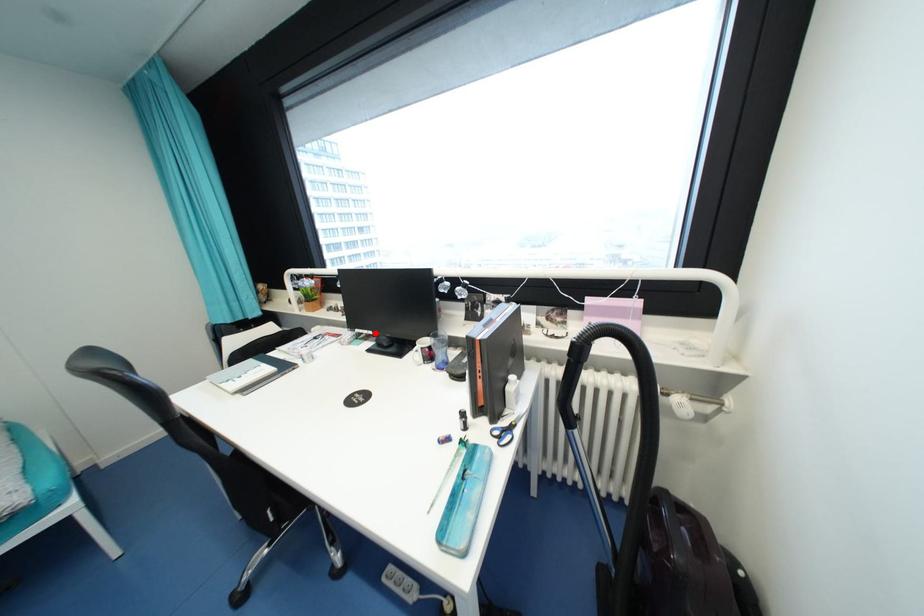
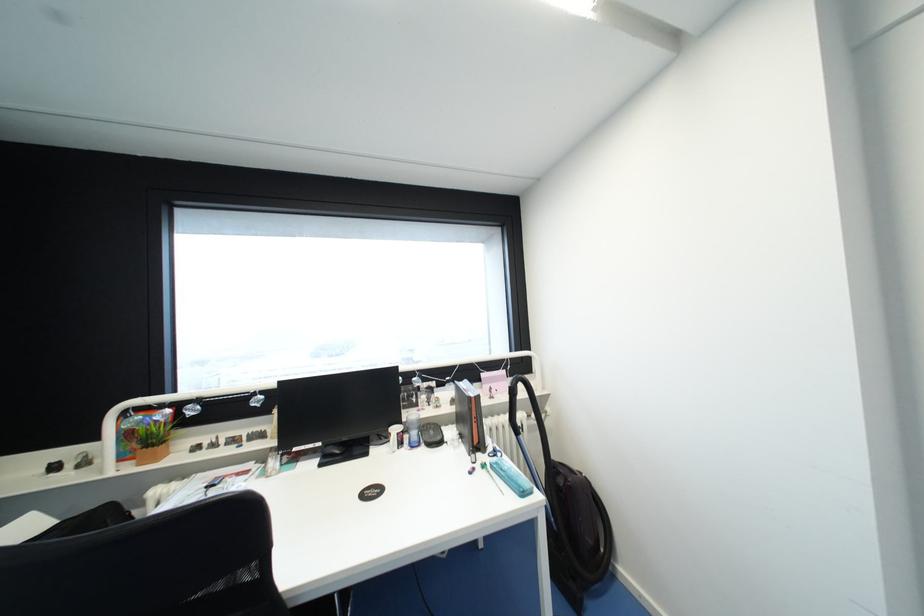
The point at the highlighted location is marked in the first image. Where is the corresponding point in the second image?

(323, 445)